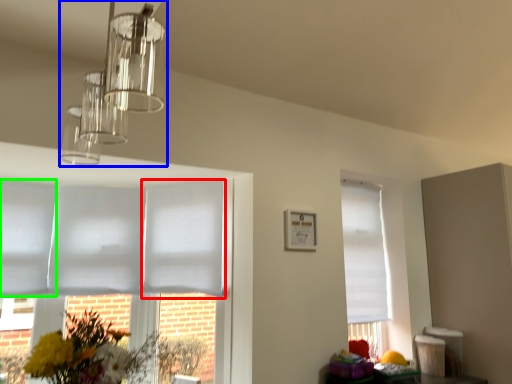
Question: Considering the real-world distances, which object is farthest from blind (highlighted by a red box)? lamp (highlighted by a blue box) or blind (highlighted by a green box)?

Choices:
 (A) lamp
 (B) blind

Answer: (A)